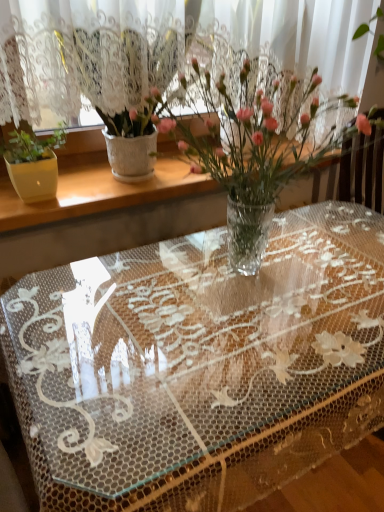
Locate an element on the screen. free region under clear plastic vase at center, positioned as the first houseplant in right-to-left order (from a real-world perspective) is located at coordinates (244, 275).